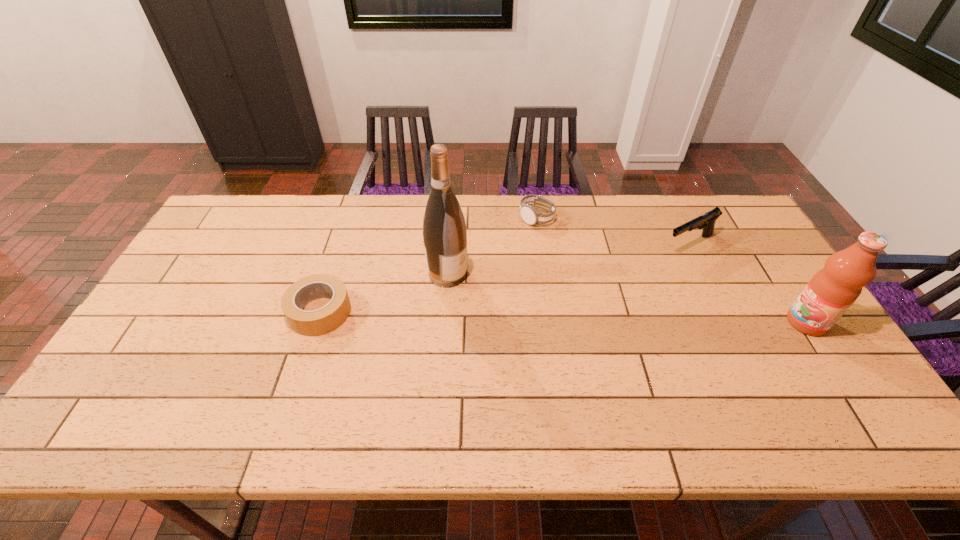
In order to click on free space in the image that satisfies the following two spatial constraints: 1. on the front side of the third tallest object; 2. on the front label of the second tallest object in this screenshot , I will do 728,322.

Find the location of a particular element. This screenshot has height=540, width=960. free space that satisfies the following two spatial constraints: 1. on the front side of the second tallest object; 2. on the front label of the second farthest object is located at coordinates (728, 322).

Locate an element on the screen. The width and height of the screenshot is (960, 540). free space that satisfies the following two spatial constraints: 1. on the front side of the fourth shortest object; 2. on the front label of the second shortest object is located at coordinates (551, 322).

Find the location of a particular element. The width and height of the screenshot is (960, 540). vacant space that satisfies the following two spatial constraints: 1. on the front side of the rightmost object; 2. on the front label of the second farthest object is located at coordinates pos(728,322).